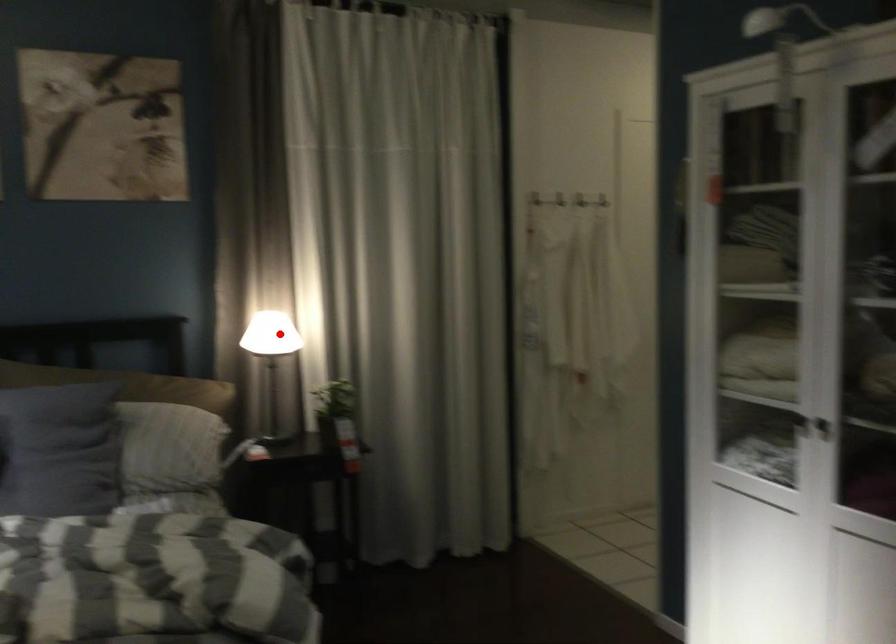
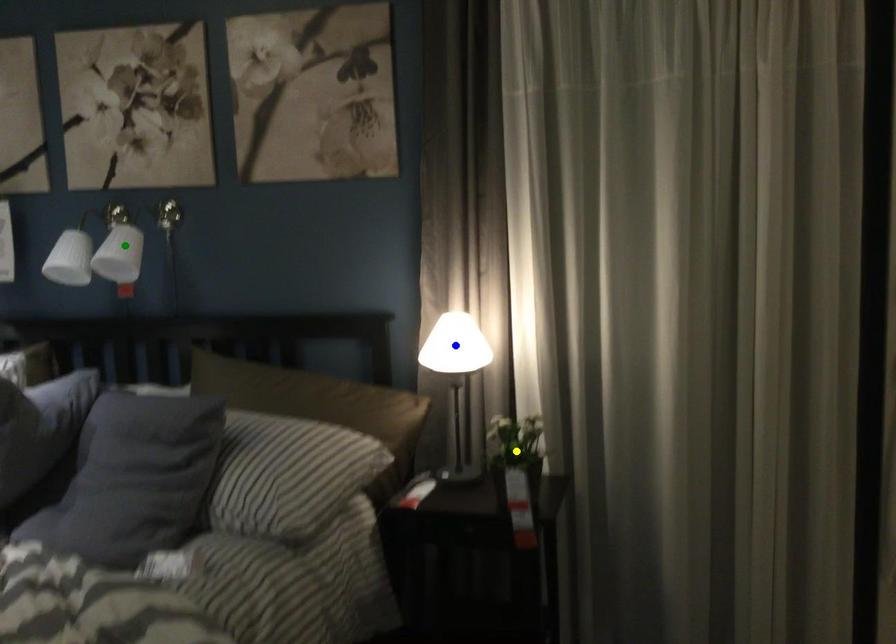
Question: I am providing you with two images of the same scene from different viewpoints. A red point is marked on the first image. You are given multiple points on the second image. Which point in image 2 is actually the same real-world point as the red point in image 1?

Choices:
 (A) yellow point
 (B) green point
 (C) blue point

Answer: (C)